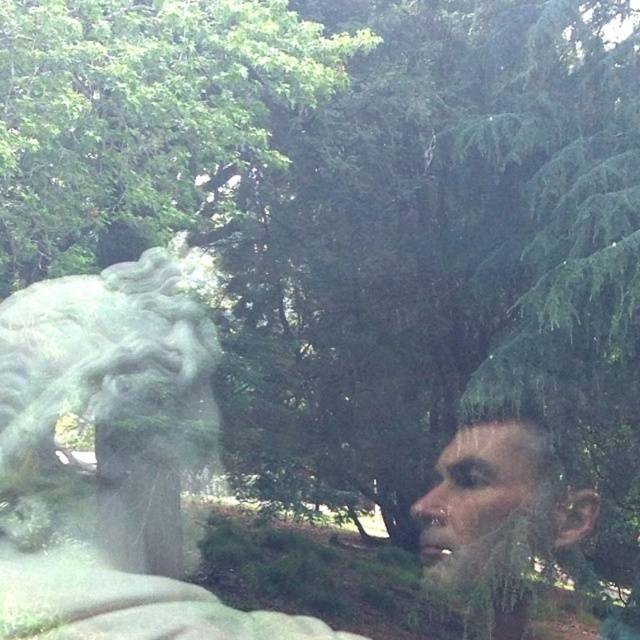
You are standing in the outdoor scene described. You want to take a photo of the green leafy tree at upper center. Where should you position yourself to capture it in the frame?

You should position yourself facing the upper center area of the scene, specifically at coordinates approximately 0.178 on the x and 0.220 on the y axis, to capture the green leafy tree at upper center in your photo.

You are standing in front of the stone lion sculpture and want to place a small flag at two specific points in the scene. The first point is at coordinates point (166,33) and the second is at point (97,465). Which point is closer to you?

Point (166,33) is closer to the viewer than point (97,465).